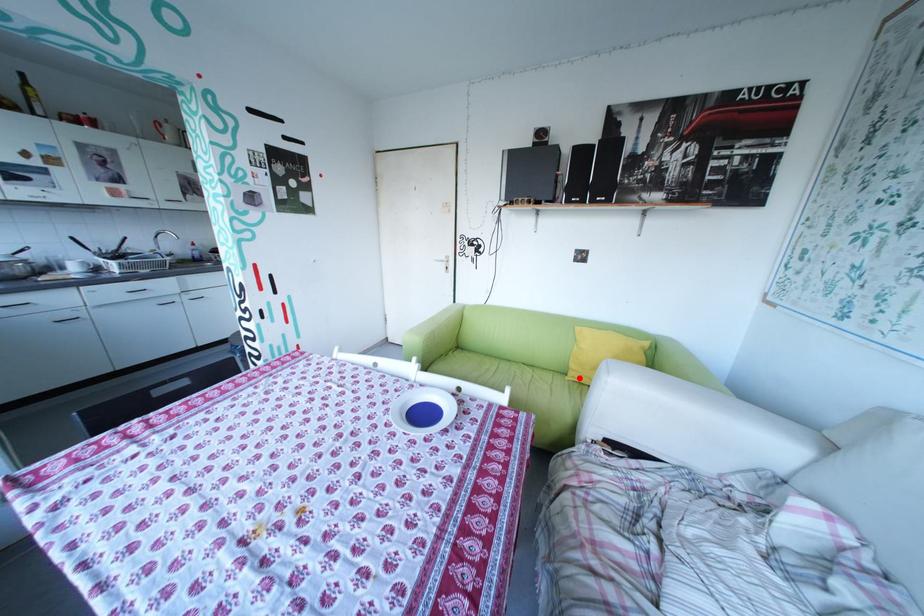
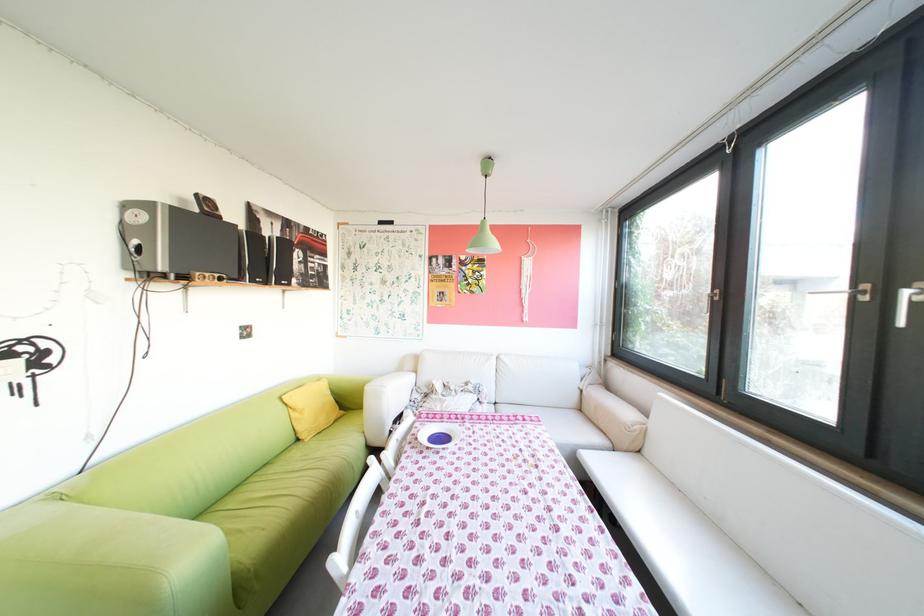
Locate, in the second image, the point that corresponds to the highlighted location in the first image.

(321, 440)